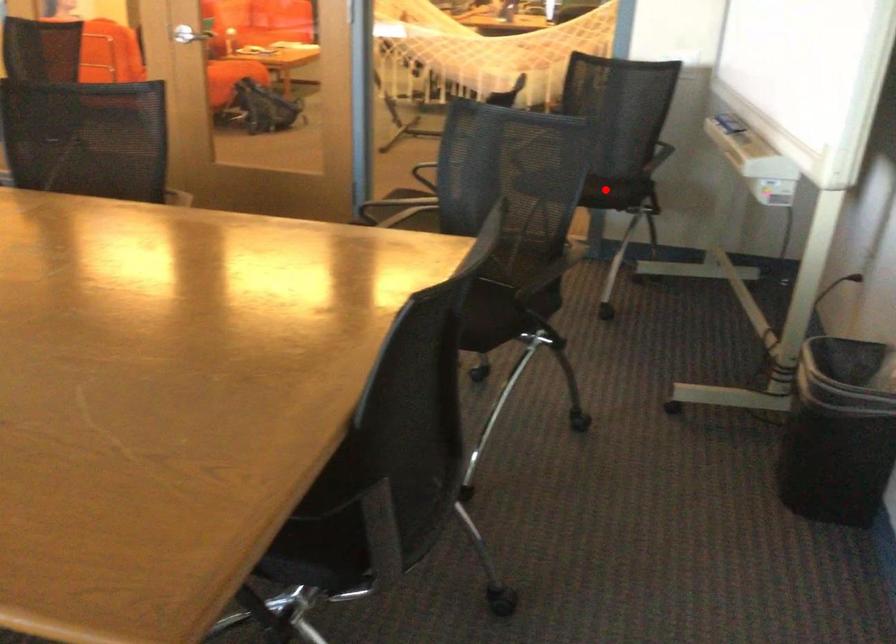
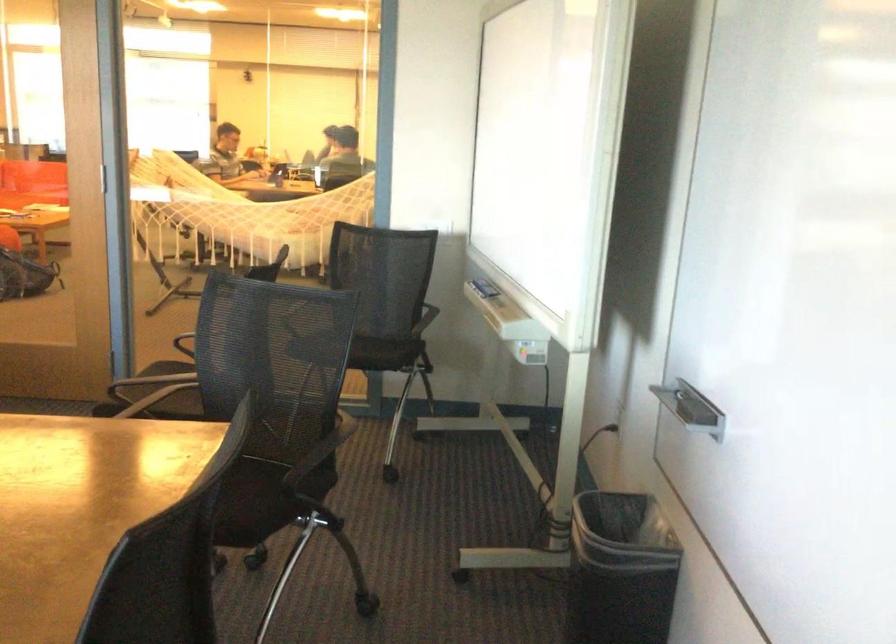
In the second image, find the point that corresponds to the highlighted location in the first image.

(376, 354)